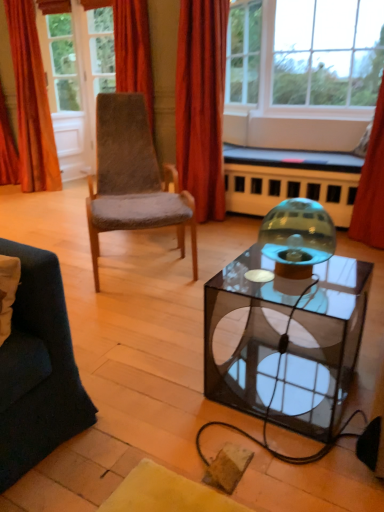
Question: From a real-world perspective, is transparent glass table at center physically located above or below transparent glass door at upper left?

Choices:
 (A) above
 (B) below

Answer: (B)

Question: Is transparent glass table at center inside the boundaries of transparent glass door at upper left, or outside?

Choices:
 (A) inside
 (B) outside

Answer: (B)

Question: Which is farther from the clear glass window at upper center, which ranks as the 2th window in right-to-left order?

Choices:
 (A) transparent glass window at upper center, which is the first window from right to left
 (B) red velvet curtain at upper center, which is the second curtain in right-to-left order
 (C) transparent glass candle holder at center
 (D) transparent glass table at center
 (E) orange velvet curtain at upper left, which is the 3th curtain in right-to-left order

Answer: (C)

Question: Which of these objects is positioned closest to the matte black couch at center?

Choices:
 (A) brown fuzzy chair at center
 (B) orange velvet curtain at upper left, which is the 3th curtain in right-to-left order
 (C) clear glass window at upper center, which is the first window in left-to-right order
 (D) transparent glass candle holder at center
 (E) transparent glass table at center

Answer: (A)